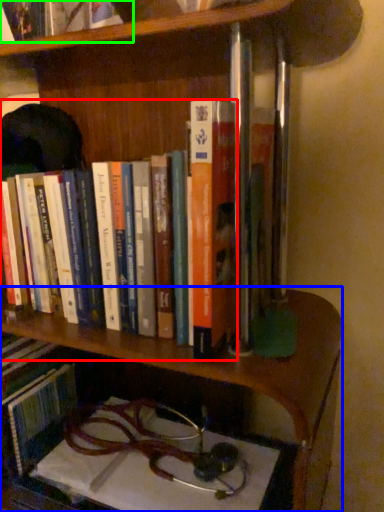
Question: Which object is the closest to the book (highlighted by a red box)? Choose among these: shelf (highlighted by a blue box) or book (highlighted by a green box).

Choices:
 (A) shelf
 (B) book

Answer: (A)